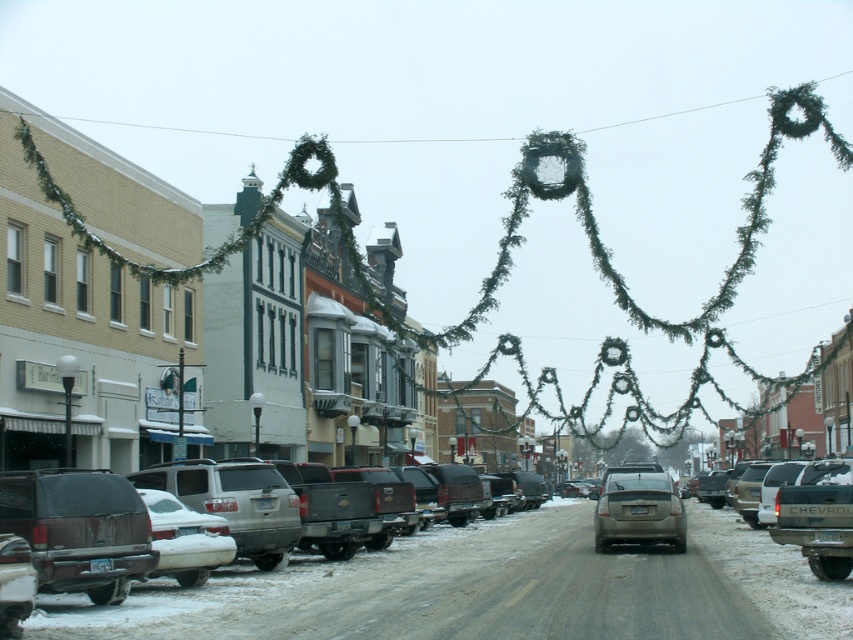
You are a delivery driver who needs to park your vehicle between the dark brown matte suv at left and the matte gray sedan at center. Your vehicle is 1.8 meters wide. Can you fit your vehicle in the space between them?

The dark brown matte suv at left has a lesser width compared to the matte gray sedan at center. Since the SUV is narrower than the sedan, the space between them might be sufficient for your 1.8 meter wide vehicle. However, without exact measurements of the gap, it is uncertain. You should check the available space carefully before attempting to park.

You are a pedestrian standing on the snowy street and want to cross to the other side. There are two vehicles parked here, a dark brown matte suv at left and a matte gray sedan at center. Which vehicle is closer to the festive wreaths hanging above the street?

The dark brown matte suv at left is closer to the festive wreaths hanging above the street because it is positioned above the matte gray sedan at center.

You are a delivery driver who needs to park your vehicle in this snowy street scene. You see a dark brown matte suv at left and a matte gray sedan at center. Which vehicle occupies less space in the parking spot?

The dark brown matte suv at left has a smaller size compared to the matte gray sedan at center, so it occupies less space in the parking spot.